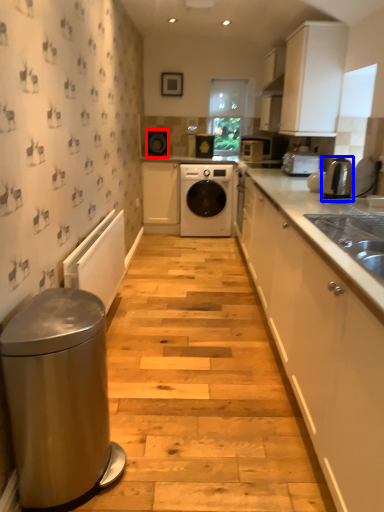
Question: Which object appears farthest to the camera in this image, appliance (highlighted by a red box) or home appliance (highlighted by a blue box)?

Choices:
 (A) appliance
 (B) home appliance

Answer: (A)